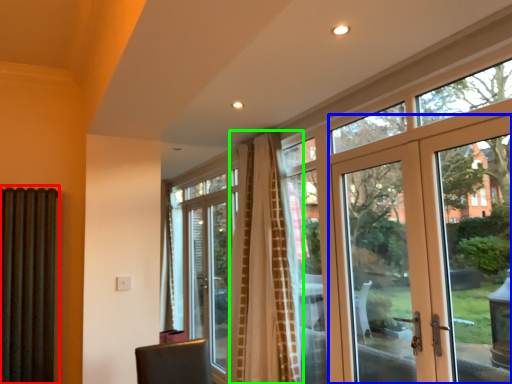
Question: Considering the real-world distances, which object is farthest from shutter (highlighted by a red box)? door (highlighted by a blue box) or curtain (highlighted by a green box)?

Choices:
 (A) door
 (B) curtain

Answer: (A)